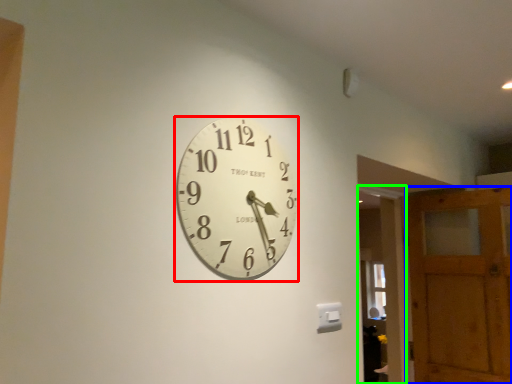
Question: Which object is positioned farthest from wall clock (highlighted by a red box)? Select from barn door (highlighted by a blue box) and glass door (highlighted by a green box).

Choices:
 (A) barn door
 (B) glass door

Answer: (A)